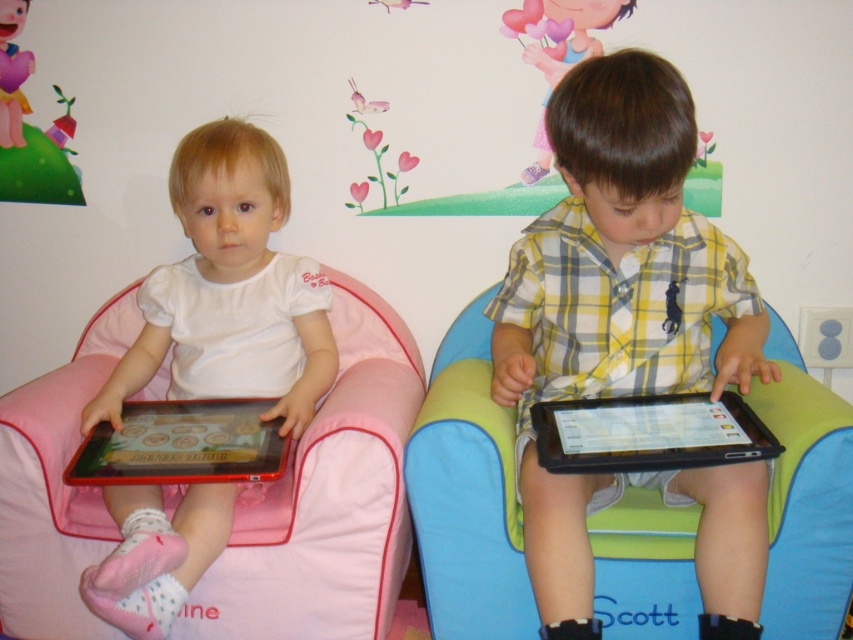
Consider the image. Is black plastic tablet at center in front of matte plastic tablet at left?

Yes, it is.

Is black plastic tablet at center taller than matte plastic tablet at left?

In fact, black plastic tablet at center may be shorter than matte plastic tablet at left.

Describe the element at coordinates (648, 433) in the screenshot. The image size is (853, 640). I see `black plastic tablet at center` at that location.

What are the coordinates of `black plastic tablet at center` in the screenshot? It's located at (648, 433).

What do you see at coordinates (183, 444) in the screenshot? This screenshot has height=640, width=853. I see `matte plastic tablet at left` at bounding box center [183, 444].

Between matte plastic tablet at left and matte pink heart at upper left, which one appears on the left side from the viewer's perspective?

matte pink heart at upper left is more to the left.

Image resolution: width=853 pixels, height=640 pixels. What are the coordinates of `matte plastic tablet at left` in the screenshot? It's located at (183, 444).

Between yellow plaid shirt at center and pink fabric bean bag chair at left, which one has less height?

pink fabric bean bag chair at left is shorter.

Is yellow plaid shirt at center above pink fabric bean bag chair at left?

Indeed, yellow plaid shirt at center is positioned over pink fabric bean bag chair at left.

Find the location of a particular element. This screenshot has height=640, width=853. yellow plaid shirt at center is located at coordinates (630, 336).